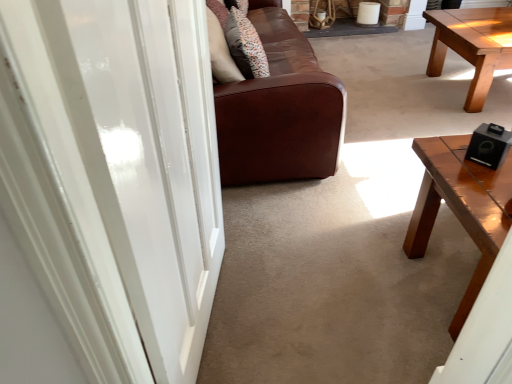
This screenshot has height=384, width=512. I want to click on vacant area located to the right-hand side of white glossy door at center, so (x=317, y=313).